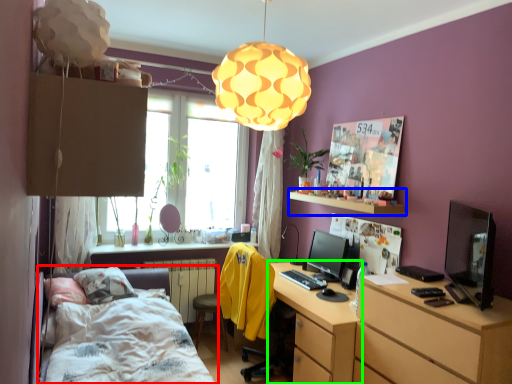
Question: Which is nearer to the bed (highlighted by a red box)? shelf (highlighted by a blue box) or desk (highlighted by a green box).

Choices:
 (A) shelf
 (B) desk

Answer: (B)